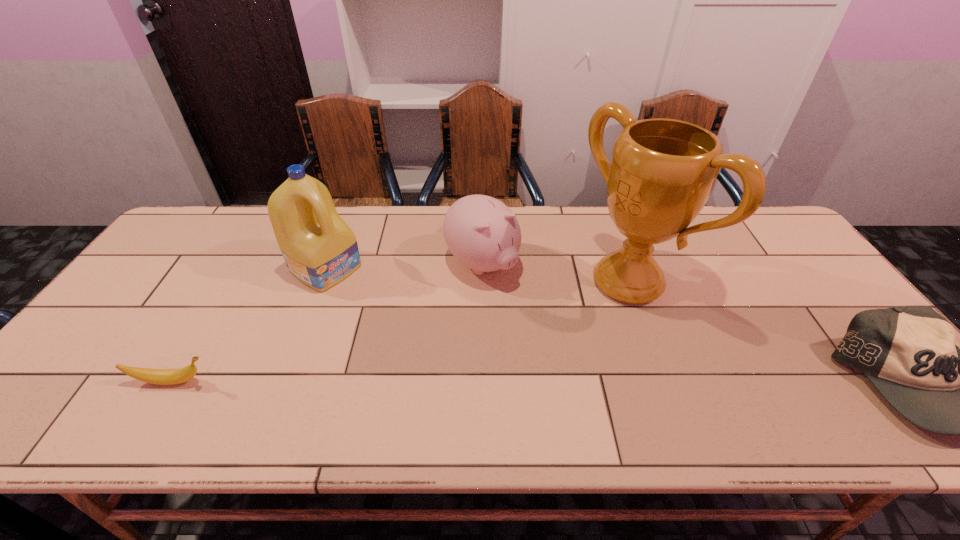
Locate an element on the screen. This screenshot has height=540, width=960. free spot between the second object from left to right and the third tallest object is located at coordinates (404, 266).

What are the coordinates of `vacant area that lies between the piggy bank and the award` in the screenshot? It's located at (555, 273).

Where is `object that is the fourth closest to the detergent`? This screenshot has height=540, width=960. object that is the fourth closest to the detergent is located at coordinates (912, 355).

The image size is (960, 540). I want to click on object that is the third closest to the second tallest object, so click(662, 173).